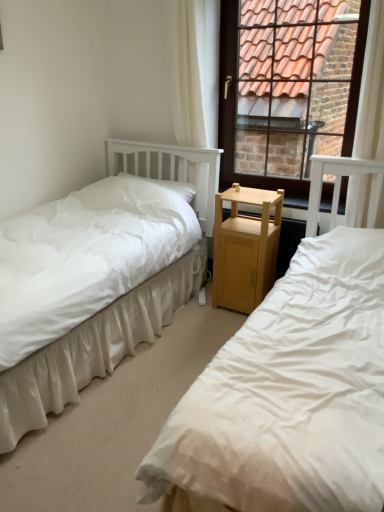
What do you see at coordinates (195, 70) in the screenshot?
I see `white fabric curtain at upper center, placed as the second curtain when sorted from right to left` at bounding box center [195, 70].

What is the approximate width of white soft pillow at center?

It is 10.22 inches.

The image size is (384, 512). What do you see at coordinates (112, 304) in the screenshot? I see `white cotton bed at left, which is counted as the 2th bed, starting from the right` at bounding box center [112, 304].

This screenshot has width=384, height=512. Describe the element at coordinates (372, 91) in the screenshot. I see `white sheer curtain at upper right, positioned as the second curtain in left-to-right order` at that location.

The width and height of the screenshot is (384, 512). What do you see at coordinates (285, 91) in the screenshot? I see `brown wooden window at upper right` at bounding box center [285, 91].

Locate an element on the screen. white fabric curtain at upper center, placed as the second curtain when sorted from right to left is located at coordinates (195, 70).

In the image, is brown wooden window at upper right on the left side or the right side of white fabric curtain at upper center, which is the first curtain from left to right?

Clearly, brown wooden window at upper right is on the right of white fabric curtain at upper center, which is the first curtain from left to right, in the image.

Considering the sizes of brown wooden window at upper right and white fabric curtain at upper center, which is the first curtain from left to right, in the image, is brown wooden window at upper right bigger or smaller than white fabric curtain at upper center, which is the first curtain from left to right,?

Considering their sizes, brown wooden window at upper right takes up more space than white fabric curtain at upper center, which is the first curtain from left to right.

Is the position of brown wooden window at upper right less distant than that of white fabric curtain at upper center, placed as the second curtain when sorted from right to left?

Yes, the depth of brown wooden window at upper right is less than that of white fabric curtain at upper center, placed as the second curtain when sorted from right to left.

Is brown wooden window at upper right wider than white fabric curtain at upper center, which is the first curtain from left to right?

No, brown wooden window at upper right is not wider than white fabric curtain at upper center, which is the first curtain from left to right.

Can you confirm if white fabric curtain at upper center, placed as the second curtain when sorted from right to left, is bigger than white fabric bed at left, which is counted as the first bed, starting from the right?

Actually, white fabric curtain at upper center, placed as the second curtain when sorted from right to left, might be smaller than white fabric bed at left, which is counted as the first bed, starting from the right.

Is white fabric curtain at upper center, placed as the second curtain when sorted from right to left, located outside white fabric bed at left, which is counted as the first bed, starting from the right?

Yes, white fabric curtain at upper center, placed as the second curtain when sorted from right to left, is outside of white fabric bed at left, which is counted as the first bed, starting from the right.

From the image's perspective, is white fabric curtain at upper center, which is the first curtain from left to right, below white fabric bed at left, which is the 2th bed in left-to-right order?

No, from the image's perspective, white fabric curtain at upper center, which is the first curtain from left to right, is not beneath white fabric bed at left, which is the 2th bed in left-to-right order.

In the scene shown: Which point is more distant from viewer, (179, 184) or (353, 144)?

The point (179, 184) is farther from the camera.

How different are the orientations of white soft pillow at center and white sheer curtain at upper right, which is the first curtain from right to left, in degrees?

They differ by 1.99 degrees in their facing directions.

Is white soft pillow at center wider or thinner than white sheer curtain at upper right, positioned as the second curtain in left-to-right order?

Considering their sizes, white soft pillow at center looks broader than white sheer curtain at upper right, positioned as the second curtain in left-to-right order.

Can you confirm if white soft pillow at center is positioned to the left of white sheer curtain at upper right, positioned as the second curtain in left-to-right order?

Correct, you'll find white soft pillow at center to the left of white sheer curtain at upper right, positioned as the second curtain in left-to-right order.

The image size is (384, 512). What are the coordinates of `the 1st curtain behind the white cotton bed at left, which is counted as the 2th bed, starting from the right` in the screenshot? It's located at (372, 91).

From the picture: Is white sheer curtain at upper right, positioned as the second curtain in left-to-right order, situated inside white cotton bed at left, arranged as the 1th bed when viewed from the left, or outside?

white sheer curtain at upper right, positioned as the second curtain in left-to-right order, is outside white cotton bed at left, arranged as the 1th bed when viewed from the left.

Is there a large distance between white sheer curtain at upper right, positioned as the second curtain in left-to-right order, and white cotton bed at left, arranged as the 1th bed when viewed from the left?

Yes, white sheer curtain at upper right, positioned as the second curtain in left-to-right order, is far from white cotton bed at left, arranged as the 1th bed when viewed from the left.

Relative to white cotton bed at left, which is counted as the 2th bed, starting from the right, is white sheer curtain at upper right, which is the first curtain from right to left, in front or behind?

Clearly, white sheer curtain at upper right, which is the first curtain from right to left, is behind white cotton bed at left, which is counted as the 2th bed, starting from the right.

From a real-world perspective, between white fabric curtain at upper center, placed as the second curtain when sorted from right to left, and light brown wood nightstand at center, who is vertically lower?

light brown wood nightstand at center.

Does white fabric curtain at upper center, which is the first curtain from left to right, appear on the right side of light brown wood nightstand at center?

No.

Considering the sizes of objects white fabric curtain at upper center, which is the first curtain from left to right, and light brown wood nightstand at center in the image provided, who is taller, white fabric curtain at upper center, which is the first curtain from left to right, or light brown wood nightstand at center?

With more height is white fabric curtain at upper center, which is the first curtain from left to right.

Based on the photo, considering the positions of objects white fabric curtain at upper center, which is the first curtain from left to right, and light brown wood nightstand at center in the image provided, who is in front, white fabric curtain at upper center, which is the first curtain from left to right, or light brown wood nightstand at center?

light brown wood nightstand at center is in front.

From the image's perspective, would you say white fabric bed at left, which is the 2th bed in left-to-right order, is shown under white fabric curtain at upper center, placed as the second curtain when sorted from right to left?

Yes.

Could you tell me if white fabric bed at left, which is the 2th bed in left-to-right order, is turned towards white fabric curtain at upper center, placed as the second curtain when sorted from right to left?

No, white fabric bed at left, which is the 2th bed in left-to-right order, is not aimed at white fabric curtain at upper center, placed as the second curtain when sorted from right to left.

Looking at this image, who is bigger, white fabric bed at left, which is counted as the first bed, starting from the right, or white fabric curtain at upper center, placed as the second curtain when sorted from right to left?

With larger size is white fabric bed at left, which is counted as the first bed, starting from the right.

From a real-world perspective, which is physically above, white fabric bed at left, which is counted as the first bed, starting from the right, or white fabric curtain at upper center, which is the first curtain from left to right?

white fabric curtain at upper center, which is the first curtain from left to right, from a real-world perspective.

Are white soft pillow at center and white fabric bed at left, which is the 2th bed in left-to-right order, beside each other?

No, white soft pillow at center is not in contact with white fabric bed at left, which is the 2th bed in left-to-right order.

How different are the orientations of white soft pillow at center and white fabric bed at left, which is counted as the first bed, starting from the right, in degrees?

They differ by 0.237 degrees in their facing directions.

Is white soft pillow at center to the left or to the right of white fabric bed at left, which is the 2th bed in left-to-right order, in the image?

white soft pillow at center is to the left of white fabric bed at left, which is the 2th bed in left-to-right order.

From the picture: Considering the sizes of white soft pillow at center and white fabric bed at left, which is counted as the first bed, starting from the right, in the image, is white soft pillow at center bigger or smaller than white fabric bed at left, which is counted as the first bed, starting from the right,?

Considering their sizes, white soft pillow at center takes up less space than white fabric bed at left, which is counted as the first bed, starting from the right.

In order to click on curtain on the left of brown wooden window at upper right in this screenshot , I will do `click(195, 70)`.

Where is `bed on the right of white fabric curtain at upper center, placed as the second curtain when sorted from right to left`? The image size is (384, 512). bed on the right of white fabric curtain at upper center, placed as the second curtain when sorted from right to left is located at coordinates (288, 395).

Based on their spatial positions, is white sheer curtain at upper right, which is the first curtain from right to left, or white fabric bed at left, which is counted as the first bed, starting from the right, closer to light brown wood nightstand at center?

white sheer curtain at upper right, which is the first curtain from right to left, lies closer to light brown wood nightstand at center than the other object.

Estimate the real-world distances between objects in this image. Which object is further from white fabric bed at left, which is counted as the first bed, starting from the right, white soft pillow at center or light brown wood nightstand at center?

The object further to white fabric bed at left, which is counted as the first bed, starting from the right, is white soft pillow at center.

Based on their spatial positions, is white cotton bed at left, which is counted as the 2th bed, starting from the right, or white fabric bed at left, which is counted as the first bed, starting from the right, further from white sheer curtain at upper right, which is the first curtain from right to left?

The object further to white sheer curtain at upper right, which is the first curtain from right to left, is white cotton bed at left, which is counted as the 2th bed, starting from the right.

Which object lies nearer to the anchor point white fabric curtain at upper center, placed as the second curtain when sorted from right to left, white cotton bed at left, arranged as the 1th bed when viewed from the left, or white fabric bed at left, which is counted as the first bed, starting from the right?

Based on the image, white cotton bed at left, arranged as the 1th bed when viewed from the left, appears to be nearer to white fabric curtain at upper center, placed as the second curtain when sorted from right to left.

When comparing their distances from brown wooden window at upper right, does light brown wood nightstand at center or white soft pillow at center seem closer?

The object closer to brown wooden window at upper right is white soft pillow at center.

Considering their positions, is brown wooden window at upper right positioned further to white soft pillow at center than light brown wood nightstand at center?

brown wooden window at upper right is positioned further to the anchor white soft pillow at center.

When comparing their distances from brown wooden window at upper right, does white fabric curtain at upper center, which is the first curtain from left to right, or white soft pillow at center seem further?

white soft pillow at center.

From the image, which object appears to be nearer to white soft pillow at center, white fabric curtain at upper center, which is the first curtain from left to right, or white cotton bed at left, which is counted as the 2th bed, starting from the right?

white fabric curtain at upper center, which is the first curtain from left to right, lies closer to white soft pillow at center than the other object.

Where is `nightstand situated between white fabric curtain at upper center, which is the first curtain from left to right, and white sheer curtain at upper right, positioned as the second curtain in left-to-right order, from left to right`? Image resolution: width=384 pixels, height=512 pixels. nightstand situated between white fabric curtain at upper center, which is the first curtain from left to right, and white sheer curtain at upper right, positioned as the second curtain in left-to-right order, from left to right is located at coordinates (245, 249).

Find the location of a particular element. The image size is (384, 512). nightstand located between white soft pillow at center and white sheer curtain at upper right, positioned as the second curtain in left-to-right order, in the left-right direction is located at coordinates (245, 249).

Locate an element on the screen. This screenshot has width=384, height=512. window between white soft pillow at center and white sheer curtain at upper right, which is the first curtain from right to left, from left to right is located at coordinates (285, 91).

At what (x,y) coordinates should I click in order to perform the action: click on curtain located between white soft pillow at center and brown wooden window at upper right in the left-right direction. Please return your answer as a coordinate pair (x, y). The height and width of the screenshot is (512, 384). Looking at the image, I should click on (195, 70).